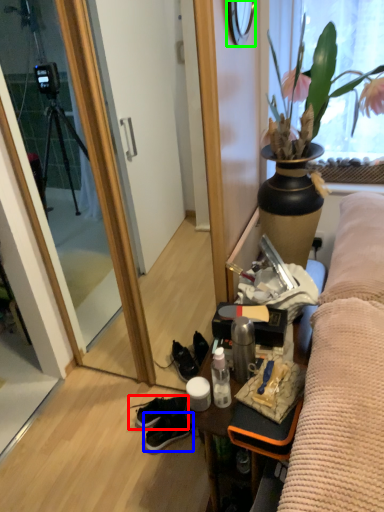
Question: Which object is positioned closest to footwear (highlighted by a red box)? Select from sneakers (highlighted by a blue box) and mirror (highlighted by a green box).

Choices:
 (A) sneakers
 (B) mirror

Answer: (A)